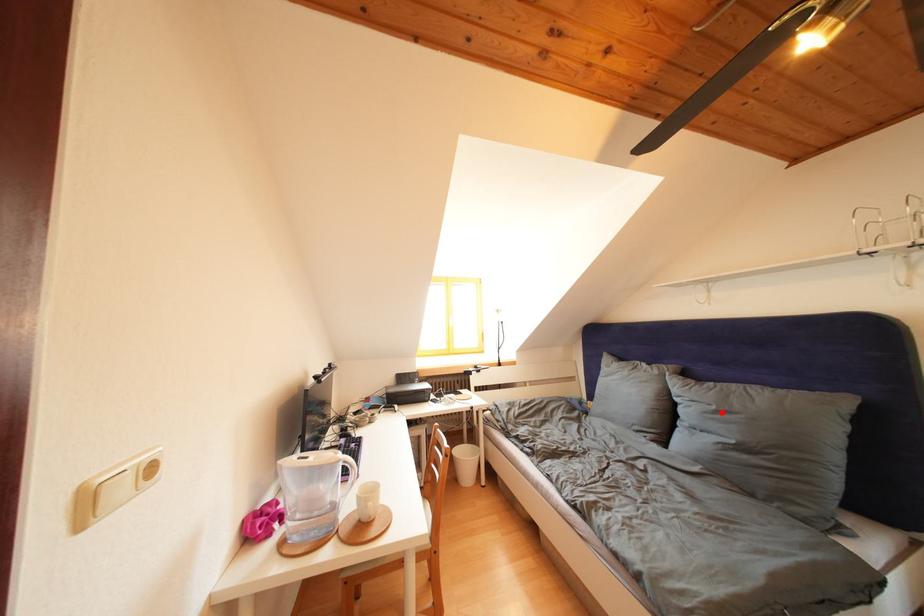
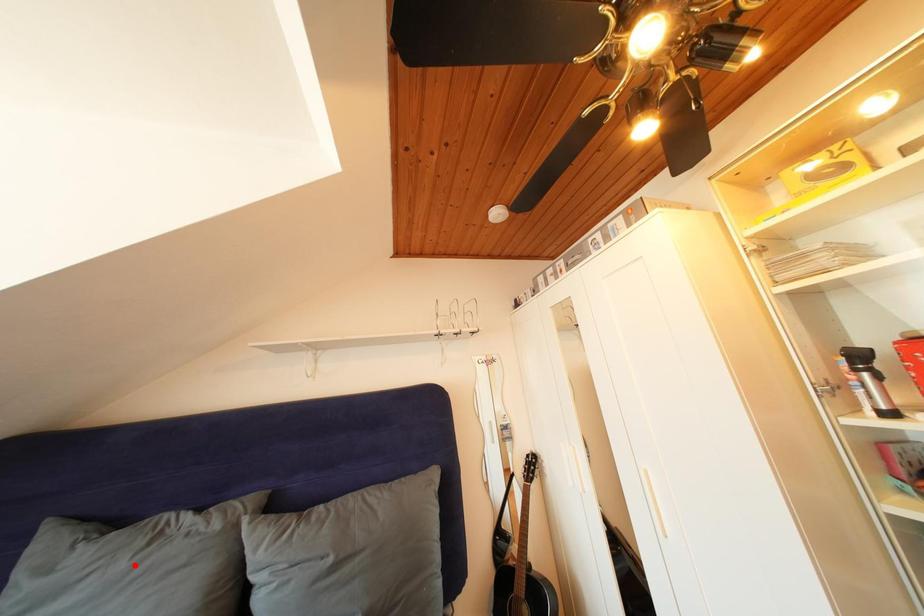
I am providing you with two images of the same scene from different viewpoints. A red point is marked on the first image and another point is marked on the second image. Does the point marked in image1 correspond to the same location as the one in image2?

No